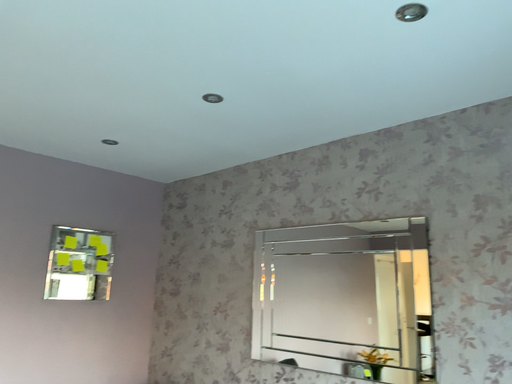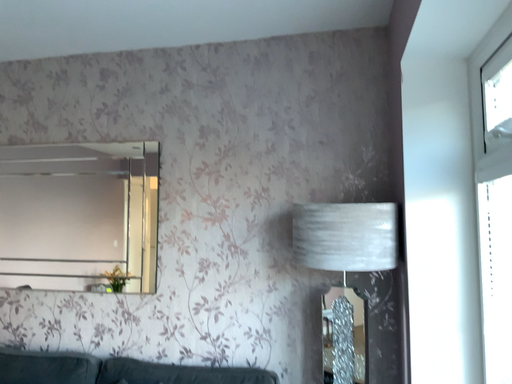
Question: How did the camera likely rotate when shooting the video?

Choices:
 (A) rotated upward
 (B) rotated downward

Answer: (B)